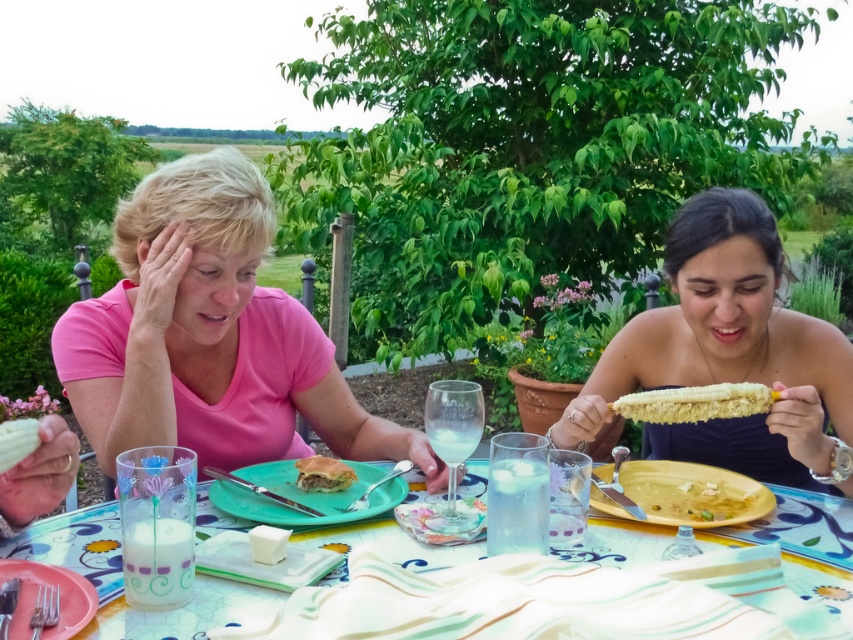
Which of these two, pink matte shirt at left or brown matte sandwich at center, stands shorter?

brown matte sandwich at center

Who is more distant from viewer, (x=91, y=396) or (x=312, y=465)?

Positioned behind is point (x=91, y=396).

Which is behind, point (405, 444) or point (326, 476)?

The point (405, 444) is behind.

Locate an element on the screen. The width and height of the screenshot is (853, 640). pink matte shirt at left is located at coordinates (210, 336).

You are a GUI agent. You are given a task and a screenshot of the screen. Output one action in this format:
    pyautogui.click(x=<x>, y=<y>)
    Task: Click on the pink matte shirt at left
    The height and width of the screenshot is (640, 853).
    Given the screenshot: What is the action you would take?
    pyautogui.click(x=210, y=336)

Between pink matte shirt at left and smooth yellow corn at right, which one is positioned lower?

Positioned lower is smooth yellow corn at right.

The height and width of the screenshot is (640, 853). What do you see at coordinates (210, 336) in the screenshot? I see `pink matte shirt at left` at bounding box center [210, 336].

I want to click on pink matte shirt at left, so click(x=210, y=336).

Which is behind, point (706, 240) or point (672, 513)?

Positioned behind is point (706, 240).

Where is `smooth yellow corn at right`? This screenshot has height=640, width=853. smooth yellow corn at right is located at coordinates (727, 353).